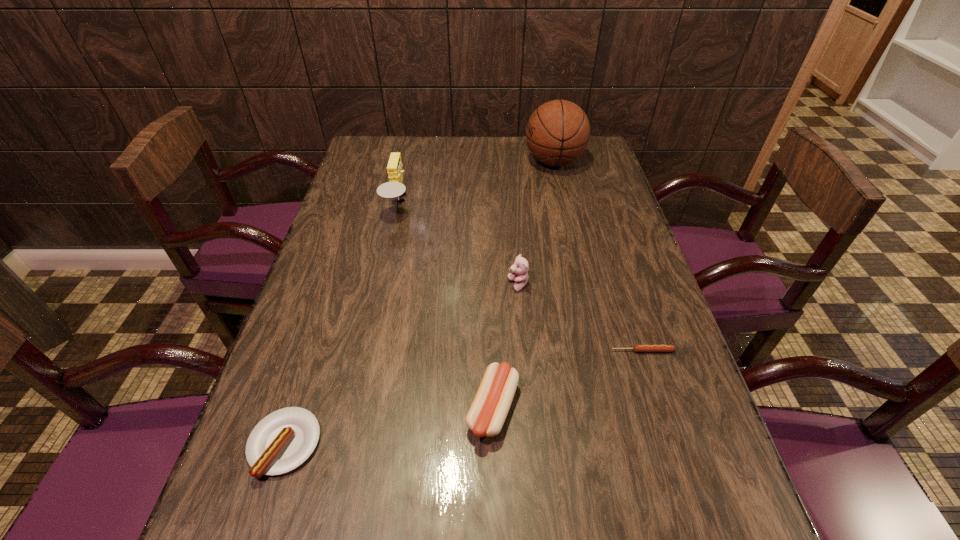
At what (x,y) coordinates should I click in order to perform the action: click on the shortest sausage. Please return your answer as a coordinate pair (x, y). This screenshot has height=540, width=960. Looking at the image, I should click on (636, 348).

Where is `the shortest object`? the shortest object is located at coordinates (636, 348).

I want to click on blank space located 0.130m on the side with brand label of the basketball, so click(x=486, y=161).

Identify the location of vacant space located on the side with brand label of the basketball. (466, 161).

Locate an element on the screen. free point located on the side with brand label of the basketball is located at coordinates (439, 161).

Locate an element on the screen. The height and width of the screenshot is (540, 960). vacant area situated 0.190m on the front-facing side of the sponge is located at coordinates tap(474, 203).

The width and height of the screenshot is (960, 540). In order to click on vacant space located 0.080m at the face of the fourth nearest object in this screenshot , I will do `click(475, 285)`.

You are a GUI agent. You are given a task and a screenshot of the screen. Output one action in this format:
    pyautogui.click(x=<x>, y=<y>)
    Task: Click on the vacant area situated at the face of the fourth nearest object
    This screenshot has width=960, height=540.
    Given the screenshot: What is the action you would take?
    pyautogui.click(x=435, y=285)

At what (x,y) coordinates should I click in order to perform the action: click on free point located 0.060m at the face of the fourth nearest object. Please return your answer as a coordinate pair (x, y). The width and height of the screenshot is (960, 540). Looking at the image, I should click on (484, 285).

You are a GUI agent. You are given a task and a screenshot of the screen. Output one action in this format:
    pyautogui.click(x=<x>, y=<y>)
    Task: Click on the vacant space positioned on the back of the tallest sausage
    
    Given the screenshot: What is the action you would take?
    pyautogui.click(x=490, y=285)